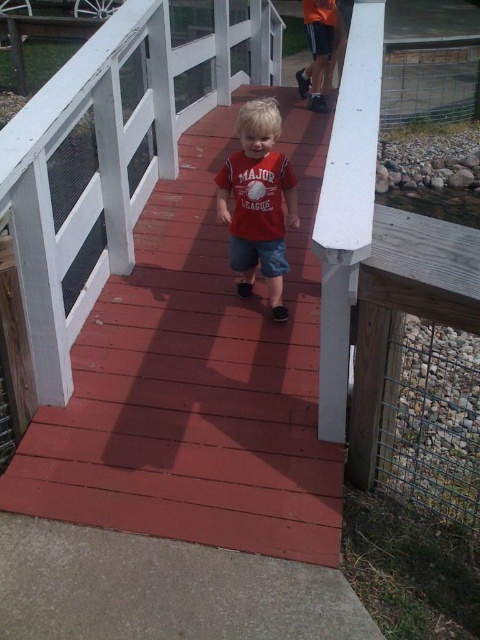
You are a photographer standing on the left side of the red wood deck at center and the matte red shirt at center. Which object is closer to your right side?

The matte red shirt at center is closer to your right side because the red wood deck at center is positioned on its left side.

You are a photographer trying to capture the scene where the child is walking on the red wooden bridge. You need to ensure that both the red wood deck at center and the matte red shirt at center are clearly visible in your shot. Considering their sizes, which object should you focus on first to ensure proper framing?

The red wood deck at center is larger in size than the matte red shirt at center, so you should focus on the red wood deck at center first to ensure it is properly framed before adjusting for the smaller matte red shirt at center.